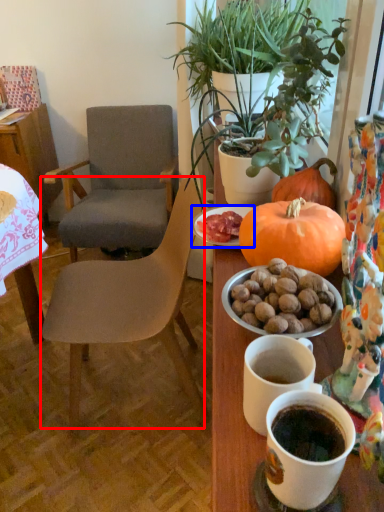
Question: Which of the following is the farthest to the observer, chair (highlighted by a red box) or plate (highlighted by a blue box)?

Choices:
 (A) chair
 (B) plate

Answer: (A)